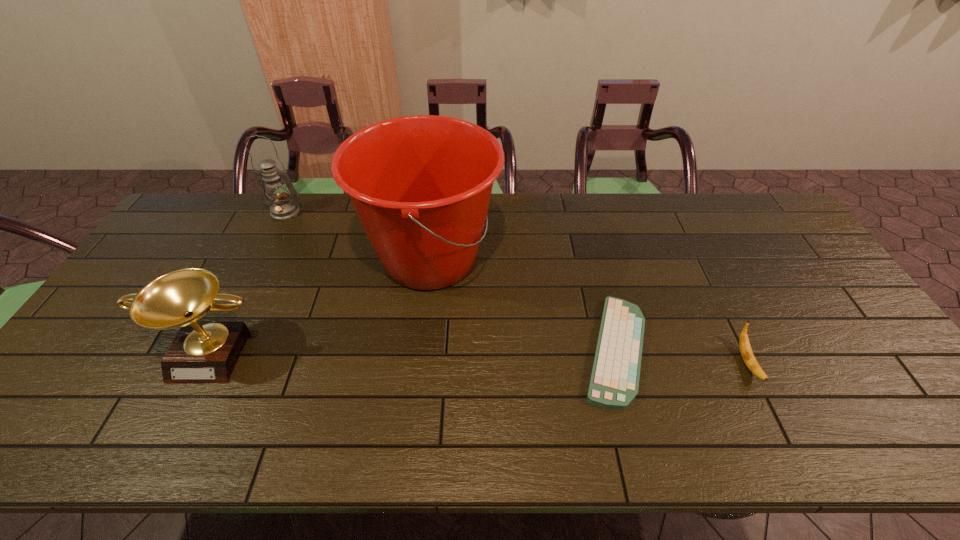
The height and width of the screenshot is (540, 960). I want to click on free space between the shortest object and the third object from left to right, so click(522, 305).

Locate an element on the screen. free space between the tallest object and the third shortest object is located at coordinates (322, 305).

Identify the location of empty location between the award and the third object from left to right. Image resolution: width=960 pixels, height=540 pixels. (322, 305).

You are a GUI agent. You are given a task and a screenshot of the screen. Output one action in this format:
    pyautogui.click(x=<x>, y=<y>)
    Task: Click on the empty location between the rightmost object and the shortest object
    Image resolution: width=960 pixels, height=540 pixels.
    Given the screenshot: What is the action you would take?
    pyautogui.click(x=681, y=356)

The image size is (960, 540). Find the location of `vacant space that is in between the oil lamp and the banana`. vacant space that is in between the oil lamp and the banana is located at coordinates (516, 288).

Locate an element on the screen. The image size is (960, 540). empty space between the award and the oil lamp is located at coordinates (250, 281).

You are a GUI agent. You are given a task and a screenshot of the screen. Output one action in this format:
    pyautogui.click(x=<x>, y=<y>)
    Task: Click on the unoccupied area between the tallest object and the fourth shortest object
    The width and height of the screenshot is (960, 540).
    Given the screenshot: What is the action you would take?
    pyautogui.click(x=358, y=236)

I want to click on free space between the third shortest object and the oil lamp, so click(x=250, y=281).

This screenshot has height=540, width=960. What are the coordinates of `unoccupied position between the fourth shortest object and the tallest object` in the screenshot? It's located at (358, 236).

Point out which object is positioned as the fourth nearest to the shortest object. Please provide its 2D coordinates. Your answer should be formatted as a tuple, i.e. [(x, y)], where the tuple contains the x and y coordinates of a point satisfying the conditions above.

[(282, 208)]